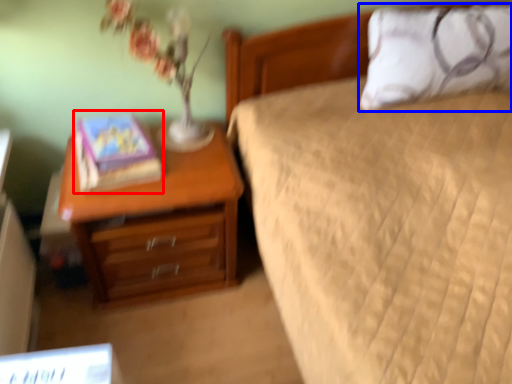
Question: Which object is closer to the camera taking this photo, book (highlighted by a red box) or pillow (highlighted by a blue box)?

Choices:
 (A) book
 (B) pillow

Answer: (A)